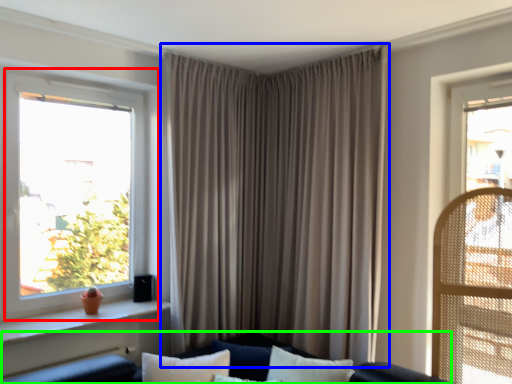
Question: Based on their relative distances, which object is farther from window (highlighted by a red box)? Choose from curtain (highlighted by a blue box) and couch (highlighted by a green box).

Choices:
 (A) curtain
 (B) couch

Answer: (B)